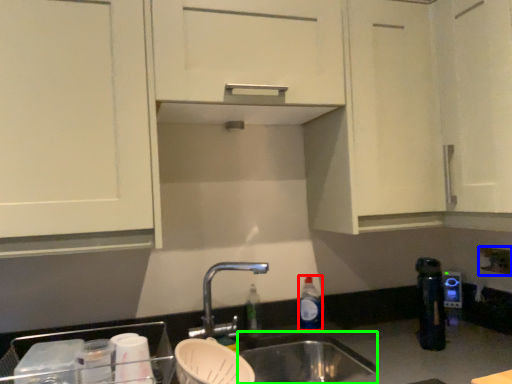
Question: Estimate the real-world distances between objects in this image. Which object is closer to bottle (highlighted by a red box), electric outlet (highlighted by a blue box) or sink (highlighted by a green box)?

Choices:
 (A) electric outlet
 (B) sink

Answer: (B)